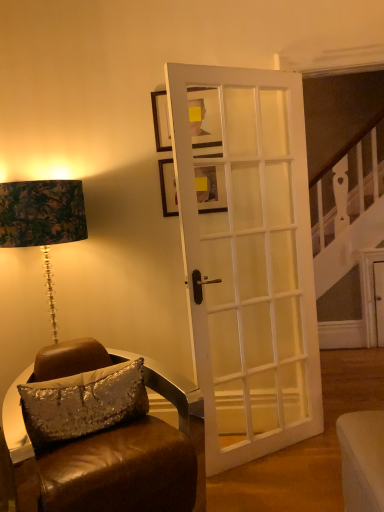
The width and height of the screenshot is (384, 512). Find the location of `matte black picture frame at upper center, marked as the first picture frame in a top-to-bottom arrangement`. matte black picture frame at upper center, marked as the first picture frame in a top-to-bottom arrangement is located at coordinates (204, 114).

Identify the location of wooden picture frame at center, which is the 2th picture frame in top-to-bottom order. Image resolution: width=384 pixels, height=512 pixels. (210, 189).

At what (x,y) coordinates should I click in order to perform the action: click on white glossy door at center. Please return your answer as a coordinate pair (x, y). The height and width of the screenshot is (512, 384). Looking at the image, I should click on (249, 263).

Considering the sizes of objects white glossy door at center and silver sequined pillow at lower left in the image provided, who is thinner, white glossy door at center or silver sequined pillow at lower left?

white glossy door at center is thinner.

Which of these two, white glossy door at center or silver sequined pillow at lower left, is bigger?

With larger size is white glossy door at center.

From a real-world perspective, which object rests below the other?

silver sequined pillow at lower left, from a real-world perspective.

Is white glossy door at center not within silver sequined pillow at lower left?

Indeed, white glossy door at center is completely outside silver sequined pillow at lower left.

From the image's perspective, is wooden picture frame at center, positioned as the 1th picture frame in bottom-to-top order, beneath brown leather chair at lower left?

Actually, wooden picture frame at center, positioned as the 1th picture frame in bottom-to-top order, appears above brown leather chair at lower left in the image.

Is point (225, 200) behind point (125, 356)?

That is False.

In terms of width, does wooden picture frame at center, which is the 2th picture frame in top-to-bottom order, look wider or thinner when compared to brown leather chair at lower left?

Clearly, wooden picture frame at center, which is the 2th picture frame in top-to-bottom order, has less width compared to brown leather chair at lower left.

Relative to brown leather chair at lower left, is wooden picture frame at center, positioned as the 1th picture frame in bottom-to-top order, in front or behind?

wooden picture frame at center, positioned as the 1th picture frame in bottom-to-top order, is positioned farther from the viewer than brown leather chair at lower left.

Which of these two, white glossy door at center or matte black picture frame at upper center, placed as the second picture frame when sorted from bottom to top, is smaller?

matte black picture frame at upper center, placed as the second picture frame when sorted from bottom to top, is smaller.

Looking at this image, is the depth of white glossy door at center less than that of matte black picture frame at upper center, placed as the second picture frame when sorted from bottom to top?

Yes, it is in front of matte black picture frame at upper center, placed as the second picture frame when sorted from bottom to top.

Where is `the 2nd picture frame positioned above the white glossy door at center (from the image's perspective)`? This screenshot has height=512, width=384. the 2nd picture frame positioned above the white glossy door at center (from the image's perspective) is located at coordinates (204, 114).

Can you confirm if white glossy door at center is positioned to the right of matte black picture frame at upper center, marked as the first picture frame in a top-to-bottom arrangement?

Yes, white glossy door at center is to the right of matte black picture frame at upper center, marked as the first picture frame in a top-to-bottom arrangement.

Is brown leather chair at lower left aimed at silver sequined pillow at lower left?

Yes, brown leather chair at lower left is aimed at silver sequined pillow at lower left.

Is brown leather chair at lower left bigger than silver sequined pillow at lower left?

Indeed, brown leather chair at lower left has a larger size compared to silver sequined pillow at lower left.

Considering the sizes of objects brown leather chair at lower left and silver sequined pillow at lower left in the image provided, who is thinner, brown leather chair at lower left or silver sequined pillow at lower left?

With smaller width is silver sequined pillow at lower left.

What's the angular difference between brown leather chair at lower left and silver sequined pillow at lower left's facing directions?

The angle between the facing direction of brown leather chair at lower left and the facing direction of silver sequined pillow at lower left is 1.62 degrees.

Is brown leather chair at lower left looking in the opposite direction of white glossy door at center?

brown leather chair at lower left does not have its back to white glossy door at center.

Considering the points (157, 468) and (240, 164), which point is behind, point (157, 468) or point (240, 164)?

The point (240, 164) is more distant.

Between brown leather chair at lower left and white glossy door at center, which one has smaller width?

white glossy door at center.

The width and height of the screenshot is (384, 512). Find the location of `door on the right of brown leather chair at lower left`. door on the right of brown leather chair at lower left is located at coordinates (249, 263).

Measure the distance from wooden picture frame at center, which is the 2th picture frame in top-to-bottom order, to silver sequined pillow at lower left.

wooden picture frame at center, which is the 2th picture frame in top-to-bottom order, is 38.97 inches from silver sequined pillow at lower left.

Between wooden picture frame at center, positioned as the 1th picture frame in bottom-to-top order, and silver sequined pillow at lower left, which one has larger size?

silver sequined pillow at lower left is bigger.

Which is correct: wooden picture frame at center, positioned as the 1th picture frame in bottom-to-top order, is inside silver sequined pillow at lower left, or outside of it?

wooden picture frame at center, positioned as the 1th picture frame in bottom-to-top order, lies outside silver sequined pillow at lower left.

Is silver sequined pillow at lower left not near wooden picture frame at center, positioned as the 1th picture frame in bottom-to-top order?

silver sequined pillow at lower left is actually quite close to wooden picture frame at center, positioned as the 1th picture frame in bottom-to-top order.

Considering the positions of objects silver sequined pillow at lower left and wooden picture frame at center, which is the 2th picture frame in top-to-bottom order, in the image provided, who is in front, silver sequined pillow at lower left or wooden picture frame at center, which is the 2th picture frame in top-to-bottom order,?

silver sequined pillow at lower left is in front.

How many degrees apart are the facing directions of silver sequined pillow at lower left and wooden picture frame at center, which is the 2th picture frame in top-to-bottom order?

The facing directions of silver sequined pillow at lower left and wooden picture frame at center, which is the 2th picture frame in top-to-bottom order, are 34.7 degrees apart.

Does point (87, 383) come closer to viewer compared to point (213, 187)?

Yes.

The height and width of the screenshot is (512, 384). What are the coordinates of `door behind the silver sequined pillow at lower left` in the screenshot? It's located at (249, 263).

At what (x,y) coordinates should I click in order to perform the action: click on the 1st picture frame located above the brown leather chair at lower left (from a real-world perspective). Please return your answer as a coordinate pair (x, y). Looking at the image, I should click on (210, 189).

Based on the photo, based on their spatial positions, is silver sequined pillow at lower left or matte black picture frame at upper center, placed as the second picture frame when sorted from bottom to top, further from brown leather chair at lower left?

Among the two, matte black picture frame at upper center, placed as the second picture frame when sorted from bottom to top, is located further to brown leather chair at lower left.

From the image, which object appears to be nearer to wooden picture frame at center, positioned as the 1th picture frame in bottom-to-top order, brown leather chair at lower left or white glossy door at center?

white glossy door at center is positioned closer to the anchor wooden picture frame at center, positioned as the 1th picture frame in bottom-to-top order.

Based on their spatial positions, is brown leather chair at lower left or wooden picture frame at center, positioned as the 1th picture frame in bottom-to-top order, closer to matte black picture frame at upper center, marked as the first picture frame in a top-to-bottom arrangement?

wooden picture frame at center, positioned as the 1th picture frame in bottom-to-top order, is positioned closer to the anchor matte black picture frame at upper center, marked as the first picture frame in a top-to-bottom arrangement.

Looking at the image, which one is located closer to brown leather chair at lower left, matte black picture frame at upper center, marked as the first picture frame in a top-to-bottom arrangement, or silver sequined pillow at lower left?

silver sequined pillow at lower left lies closer to brown leather chair at lower left than the other object.

Looking at the image, which one is located further to matte black picture frame at upper center, marked as the first picture frame in a top-to-bottom arrangement, wooden picture frame at center, which is the 2th picture frame in top-to-bottom order, or brown leather chair at lower left?

The object further to matte black picture frame at upper center, marked as the first picture frame in a top-to-bottom arrangement, is brown leather chair at lower left.

Based on their spatial positions, is silver sequined pillow at lower left or brown leather chair at lower left further from white glossy door at center?

Among the two, silver sequined pillow at lower left is located further to white glossy door at center.

Estimate the real-world distances between objects in this image. Which object is closer to silver sequined pillow at lower left, brown leather chair at lower left or wooden picture frame at center, positioned as the 1th picture frame in bottom-to-top order?

brown leather chair at lower left is closer to silver sequined pillow at lower left.

Estimate the real-world distances between objects in this image. Which object is further from white glossy door at center, wooden picture frame at center, positioned as the 1th picture frame in bottom-to-top order, or matte black picture frame at upper center, marked as the first picture frame in a top-to-bottom arrangement?

matte black picture frame at upper center, marked as the first picture frame in a top-to-bottom arrangement.

This screenshot has width=384, height=512. Find the location of `pillow between wooden picture frame at center, positioned as the 1th picture frame in bottom-to-top order, and brown leather chair at lower left from top to bottom`. pillow between wooden picture frame at center, positioned as the 1th picture frame in bottom-to-top order, and brown leather chair at lower left from top to bottom is located at coordinates (83, 403).

Identify the location of door between matte black picture frame at upper center, placed as the second picture frame when sorted from bottom to top, and silver sequined pillow at lower left vertically. 249,263.

I want to click on chair between silver sequined pillow at lower left and white glossy door at center from left to right, so click(x=108, y=445).

Find the location of `door between wooden picture frame at center, positioned as the 1th picture frame in bottom-to-top order, and silver sequined pillow at lower left from top to bottom`. door between wooden picture frame at center, positioned as the 1th picture frame in bottom-to-top order, and silver sequined pillow at lower left from top to bottom is located at coordinates (249, 263).